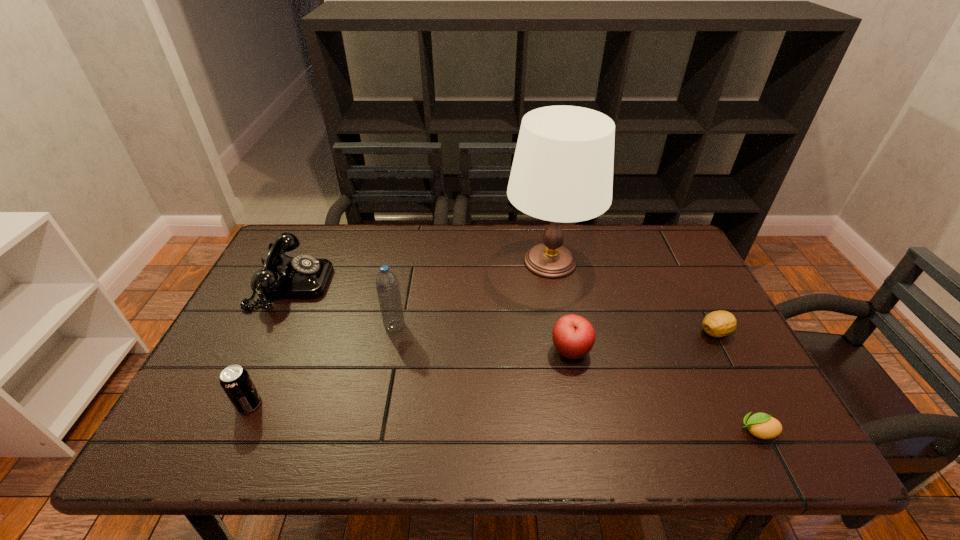
I want to click on lamp, so pyautogui.click(x=562, y=171).

At what (x,y) coordinates should I click in order to perform the action: click on the sixth shortest object. Please return your answer as a coordinate pair (x, y). The image size is (960, 540). Looking at the image, I should click on (387, 285).

Locate an element on the screen. The image size is (960, 540). water bottle is located at coordinates (387, 285).

The height and width of the screenshot is (540, 960). In order to click on telephone in this screenshot , I will do `click(282, 277)`.

Find the location of a particular element. This screenshot has height=540, width=960. the second nearest object is located at coordinates (236, 382).

Find the location of `apple`. apple is located at coordinates (573, 336).

Image resolution: width=960 pixels, height=540 pixels. In order to click on the farther lemon in this screenshot , I will do `click(720, 323)`.

Identify the location of the sixth tallest object. (720, 323).

Find the location of a particular element. the nearer lemon is located at coordinates (761, 425).

Locate an element on the screen. the nearest object is located at coordinates [x=761, y=425].